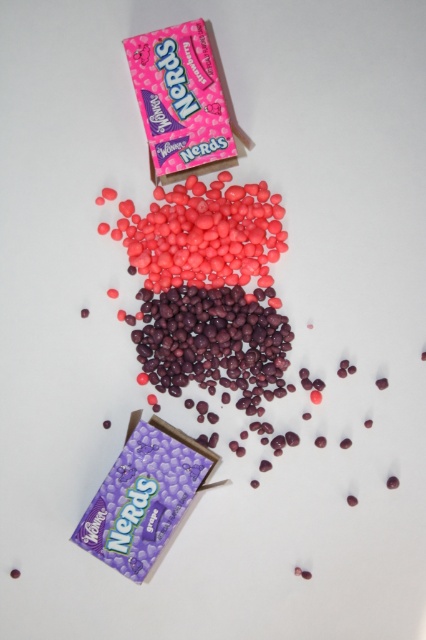
Who is higher up, glossy pink nerds at center or pink matte nerds at upper left?

Positioned higher is pink matte nerds at upper left.

Which is in front, point (253, 204) or point (175, 102)?

Positioned in front is point (175, 102).

Where is `glossy pink nerds at center`? Image resolution: width=426 pixels, height=640 pixels. glossy pink nerds at center is located at coordinates (204, 234).